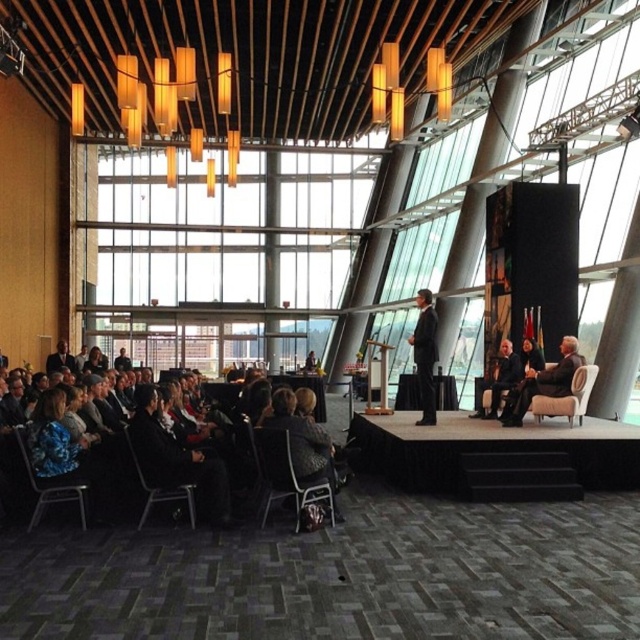
Question: Can you confirm if beige fabric armchair at right is bigger than metallic gray chair at lower left?

Choices:
 (A) no
 (B) yes

Answer: (B)

Question: Estimate the real-world distances between objects in this image. Which object is closer to the dark gray fabric chairs at lower left?

Choices:
 (A) black fabric chair at lower center
 (B) light beige leather chair at right
 (C) blue fabric chair at lower left

Answer: (C)

Question: Which point is closer to the camera taking this photo?

Choices:
 (A) (144, 474)
 (B) (433, 387)
 (C) (337, 522)

Answer: (A)

Question: Is the position of dark gray fabric chairs at lower left less distant than that of blue fabric chair at lower left?

Choices:
 (A) no
 (B) yes

Answer: (A)

Question: Which object is the closest to the dark gray fabric chairs at lower left?

Choices:
 (A) beige fabric armchair at right
 (B) black fabric chair at lower center
 (C) metallic gray chair at lower left
 (D) blue fabric chair at lower left

Answer: (C)

Question: Is light beige leather chair at right below dark suit at center?

Choices:
 (A) yes
 (B) no

Answer: (A)